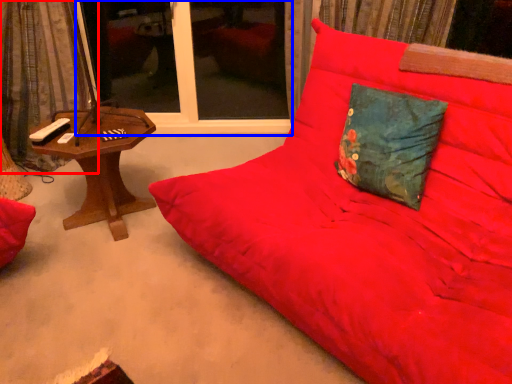
Question: Which point is closer to the camera, curtain (highlighted by a red box) or window screen (highlighted by a blue box)?

Choices:
 (A) curtain
 (B) window screen

Answer: (A)